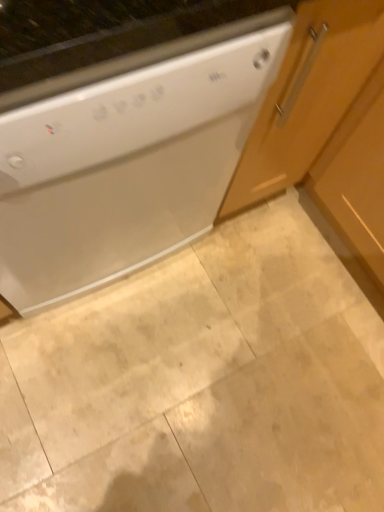
Question: Is the position of white glossy dishwasher at upper left more distant than that of beige marble floor at center?

Choices:
 (A) no
 (B) yes

Answer: (A)

Question: Is white glossy dishwasher at upper left with beige marble floor at center?

Choices:
 (A) no
 (B) yes

Answer: (A)

Question: Would you say white glossy dishwasher at upper left contains beige marble floor at center?

Choices:
 (A) no
 (B) yes

Answer: (A)

Question: Is white glossy dishwasher at upper left shorter than beige marble floor at center?

Choices:
 (A) no
 (B) yes

Answer: (A)

Question: Is white glossy dishwasher at upper left bigger than beige marble floor at center?

Choices:
 (A) no
 (B) yes

Answer: (B)

Question: From a real-world perspective, is white glossy dishwasher at upper left located higher than beige marble floor at center?

Choices:
 (A) yes
 (B) no

Answer: (A)

Question: Considering the relative sizes of wooden cabinet at right and beige marble floor at center in the image provided, is wooden cabinet at right shorter than beige marble floor at center?

Choices:
 (A) yes
 (B) no

Answer: (B)

Question: Is wooden cabinet at right smaller than beige marble floor at center?

Choices:
 (A) no
 (B) yes

Answer: (A)

Question: From the image's perspective, is wooden cabinet at right under beige marble floor at center?

Choices:
 (A) yes
 (B) no

Answer: (B)

Question: From the image's perspective, is wooden cabinet at right on beige marble floor at center?

Choices:
 (A) yes
 (B) no

Answer: (A)

Question: Does wooden cabinet at right turn towards beige marble floor at center?

Choices:
 (A) no
 (B) yes

Answer: (B)

Question: Is wooden cabinet at right positioned behind beige marble floor at center?

Choices:
 (A) yes
 (B) no

Answer: (B)

Question: Does white glossy dishwasher at upper left have a smaller size compared to wooden cabinet at right?

Choices:
 (A) yes
 (B) no

Answer: (A)